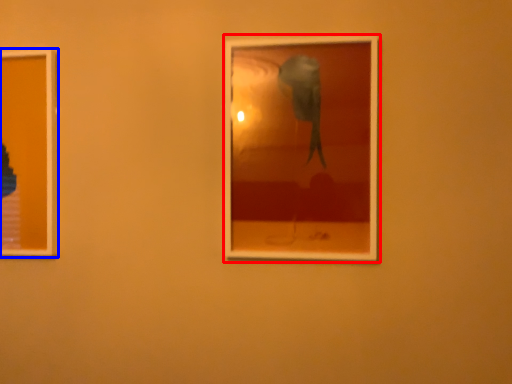
Question: Which of the following is the closest to the observer, picture frame (highlighted by a red box) or picture frame (highlighted by a blue box)?

Choices:
 (A) picture frame
 (B) picture frame

Answer: (A)